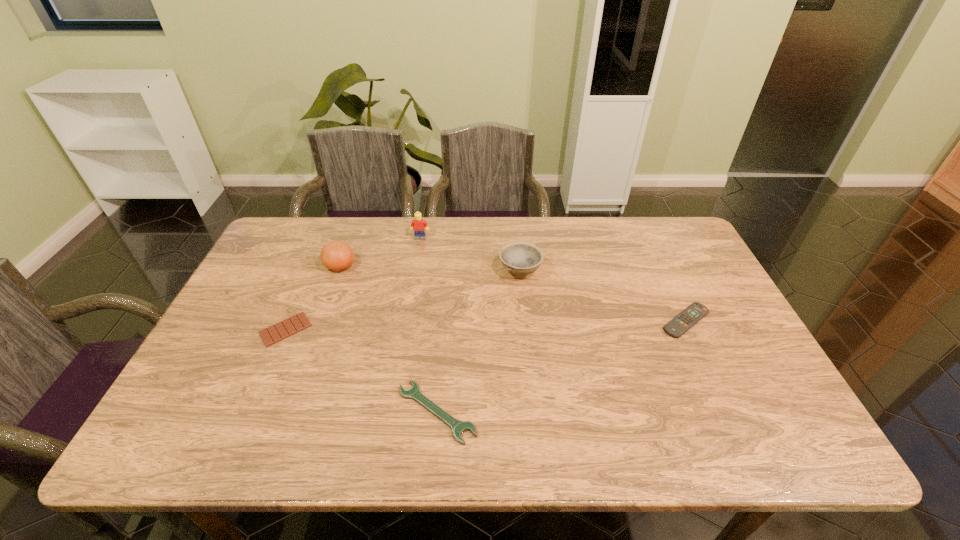
This screenshot has width=960, height=540. What are the coordinates of `the tallest object` in the screenshot? It's located at (419, 226).

Locate an element on the screen. The height and width of the screenshot is (540, 960). Lego is located at coordinates (419, 226).

Locate an element on the screen. clementine is located at coordinates (336, 255).

I want to click on the second object from right to left, so click(519, 258).

Identify the location of bowl. (519, 258).

Find the location of `remote control`. remote control is located at coordinates (680, 324).

Locate an element on the screen. the rightmost object is located at coordinates (680, 324).

Find the location of a particular element. This screenshot has height=540, width=960. the nearest object is located at coordinates (458, 427).

At what (x,y) coordinates should I click in order to perform the action: click on the fifth tallest object. Please return your answer as a coordinate pair (x, y). Looking at the image, I should click on (458, 427).

What are the coordinates of `the shortest object` in the screenshot? It's located at (294, 324).